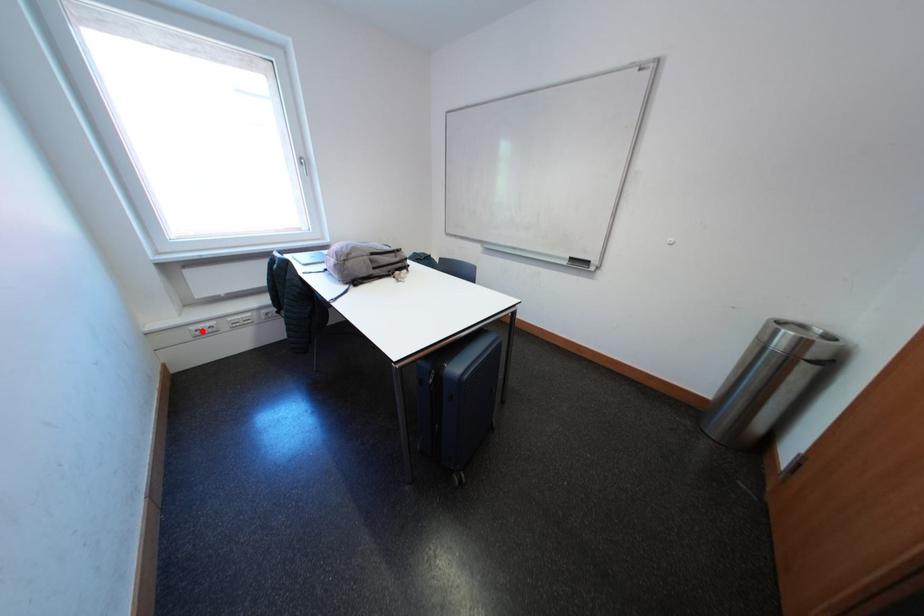
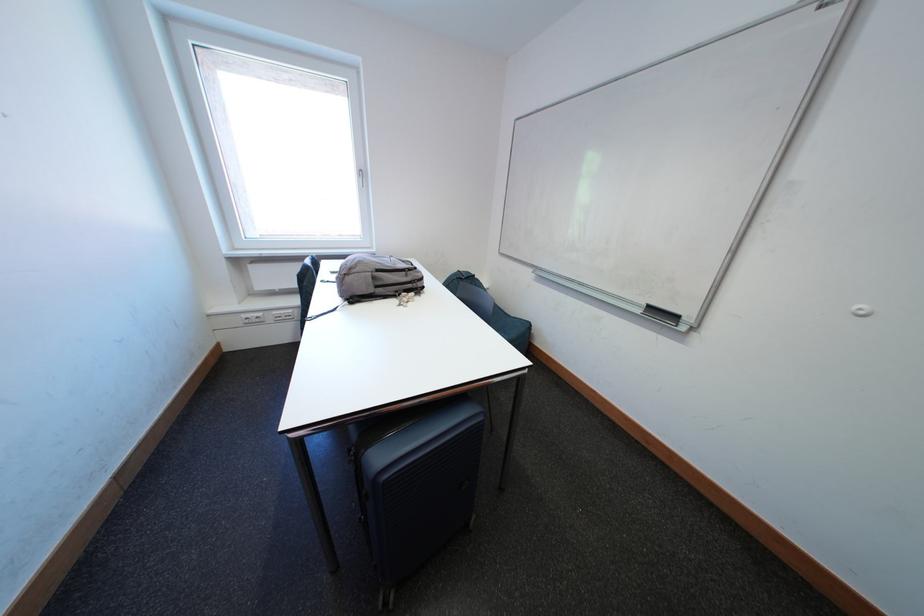
In the second image, find the point that corresponds to the highlighted location in the first image.

(253, 320)